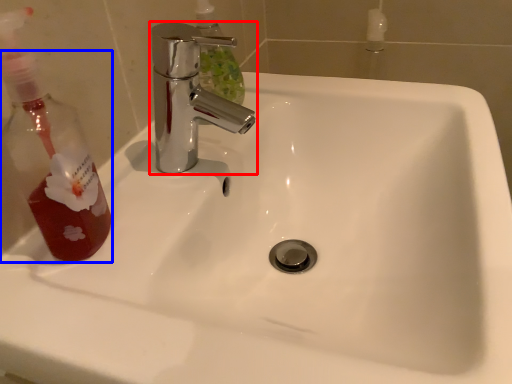
Question: Which of the following is the closest to the observer, tap (highlighted by a red box) or mouthwash (highlighted by a blue box)?

Choices:
 (A) tap
 (B) mouthwash

Answer: (B)